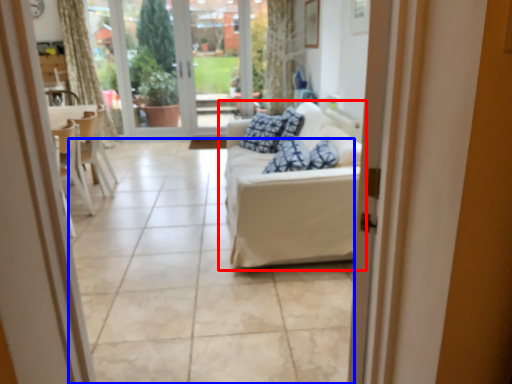
Question: Which object appears closest to the camera in this image, studio couch (highlighted by a red box) or tile (highlighted by a blue box)?

Choices:
 (A) studio couch
 (B) tile

Answer: (B)